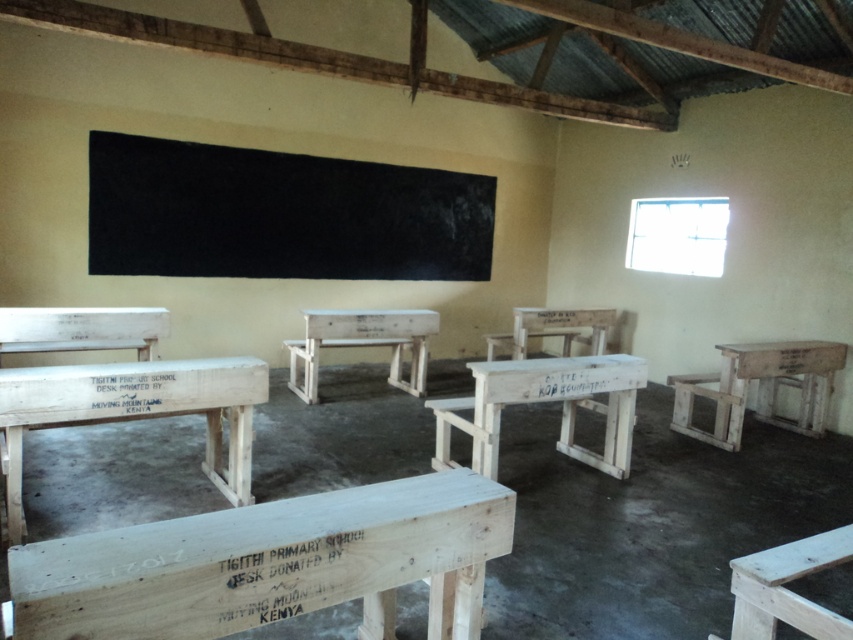
Question: Can you confirm if light wood bench at center is bigger than light brown wooden stool at lower right?

Choices:
 (A) no
 (B) yes

Answer: (B)

Question: Can you confirm if white wood bench at left is positioned below light brown wooden stool at lower right?

Choices:
 (A) yes
 (B) no

Answer: (B)

Question: Which point appears closest to the camera in this image?

Choices:
 (A) (805, 538)
 (B) (479, 180)

Answer: (A)

Question: Does white wooden desk at right have a smaller size compared to light brown wooden stool at lower right?

Choices:
 (A) yes
 (B) no

Answer: (B)

Question: Which of the following is the closest to the observer?

Choices:
 (A) (743, 580)
 (B) (633, 362)
 (C) (138, 600)

Answer: (C)

Question: Which point is farther to the camera?

Choices:
 (A) (715, 426)
 (B) (42, 333)
 (C) (195, 598)
 (D) (421, 323)

Answer: (D)